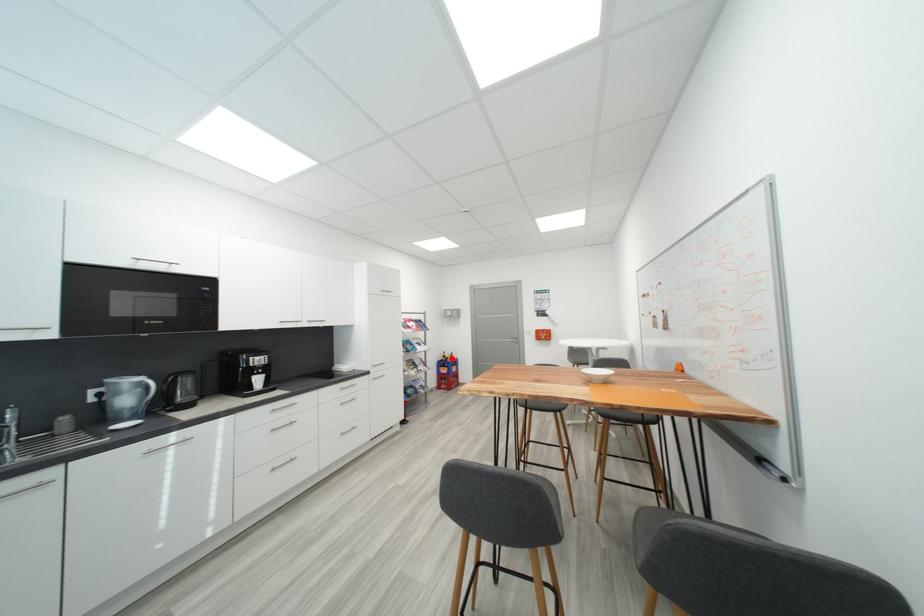
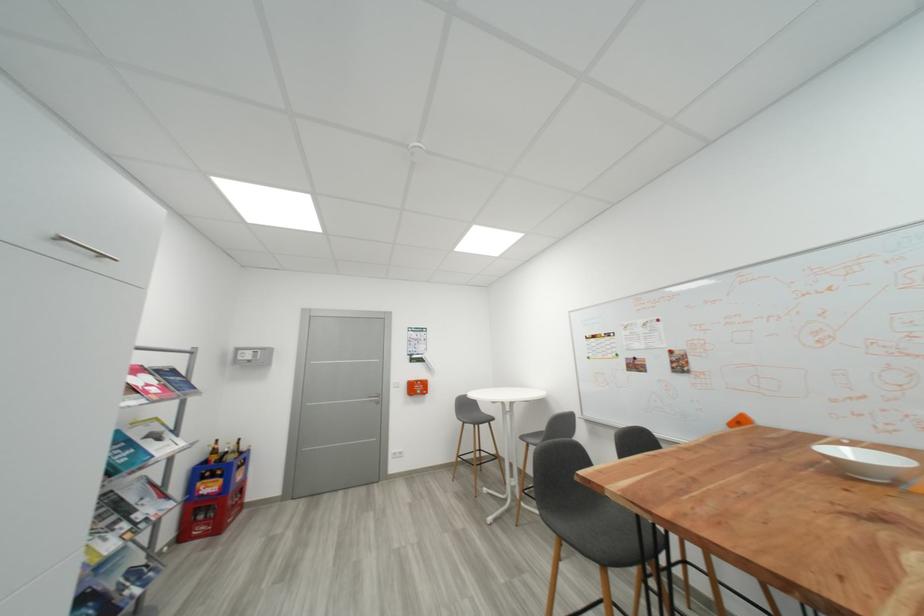
Question: A red point is marked in image1. In image2, is the corresponding 3D point closer to the camera or farther? Reply with the corresponding letter.

Choices:
 (A) The corresponding 3D point is closer.
 (B) The corresponding 3D point is farther.

Answer: (A)